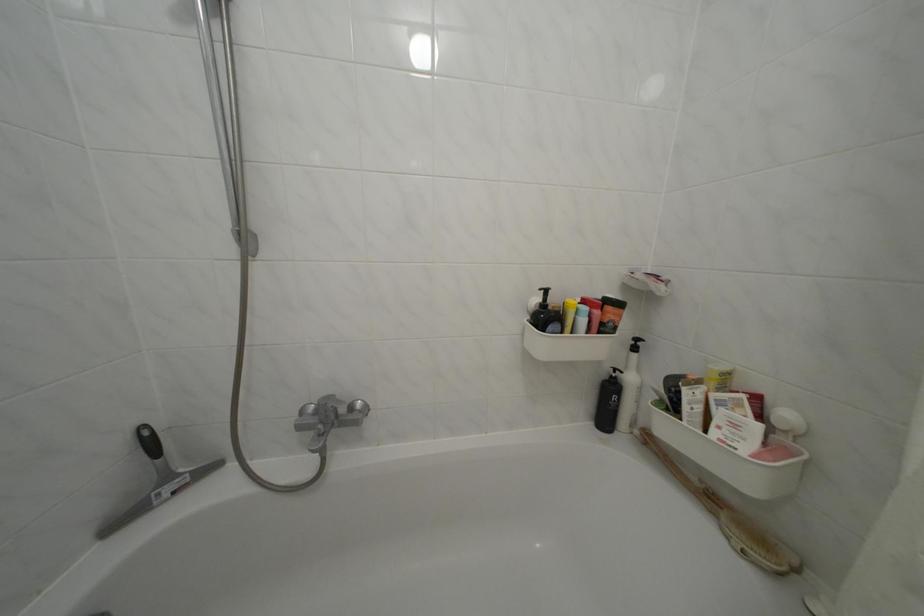
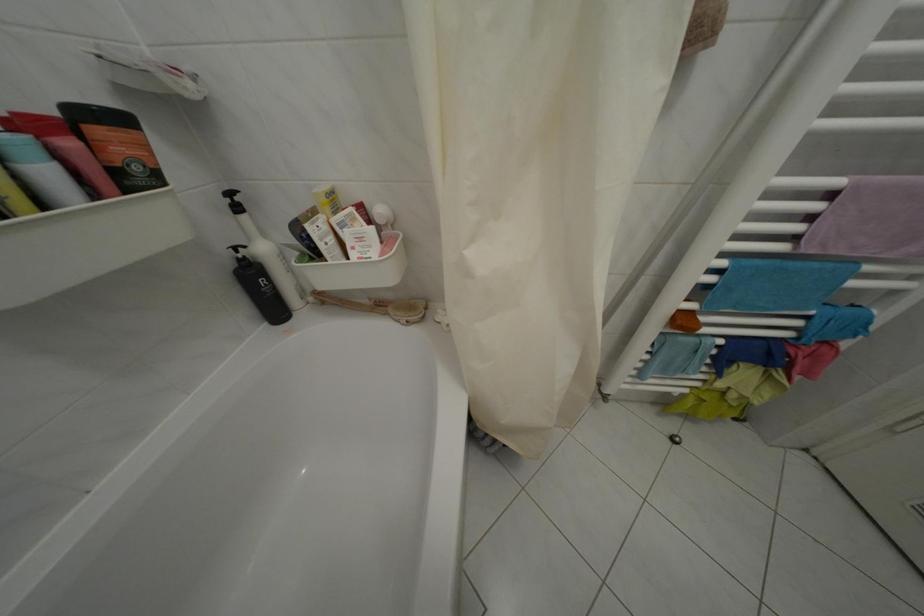
Find the pixel in the second image that matches [710,487] in the first image.

(379, 306)